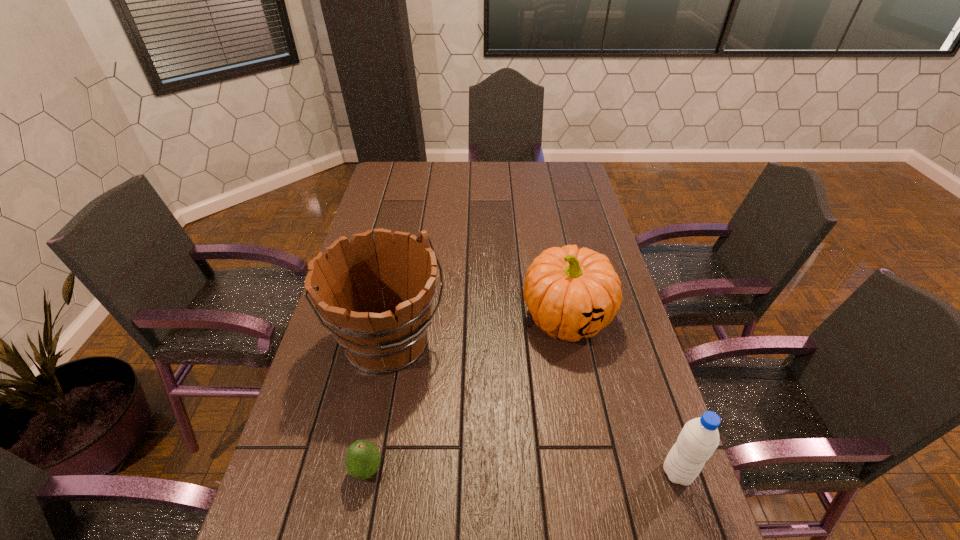
Locate an element on the screen. avocado is located at coordinates (362, 460).

Find the location of a particular element. This screenshot has height=540, width=960. water bottle is located at coordinates (699, 438).

Identify the location of wine bucket. The height and width of the screenshot is (540, 960). (344, 283).

This screenshot has width=960, height=540. In order to click on the second object from right to left in this screenshot , I will do `click(571, 293)`.

The width and height of the screenshot is (960, 540). I want to click on vacant region located 0.210m on the back of the shortest object, so click(x=384, y=377).

Identify the location of free space located on the left of the rightmost object. This screenshot has height=540, width=960. (589, 472).

The width and height of the screenshot is (960, 540). Identify the location of vacant region located with the handle on the wine bucket. (474, 442).

I want to click on vacant space located 0.330m with the handle on the wine bucket, so click(x=506, y=478).

Where is `free region located with the handle on the wine bucket`? The width and height of the screenshot is (960, 540). free region located with the handle on the wine bucket is located at coordinates (444, 407).

This screenshot has width=960, height=540. What are the coordinates of `free space located on the surface of the second object from right to left` in the screenshot? It's located at (490, 458).